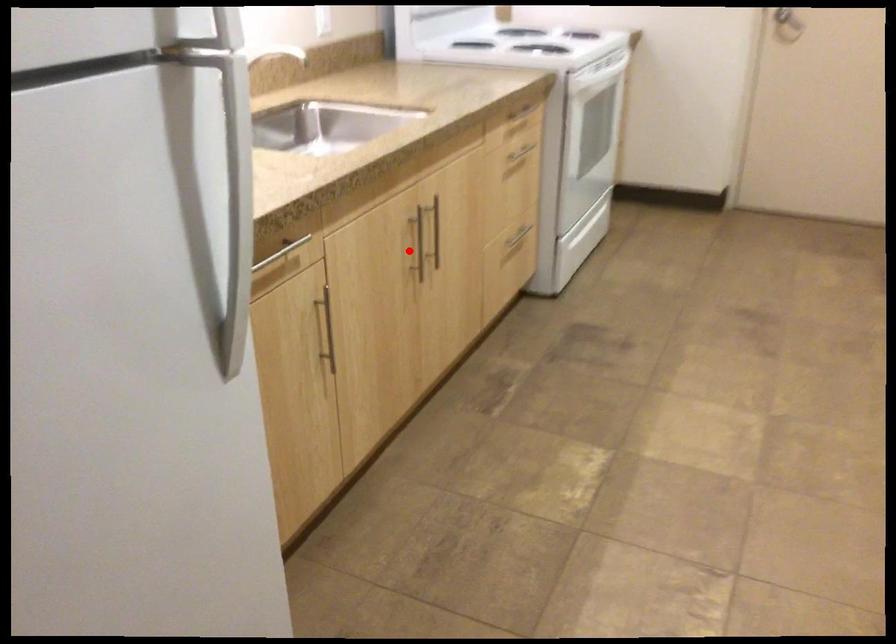
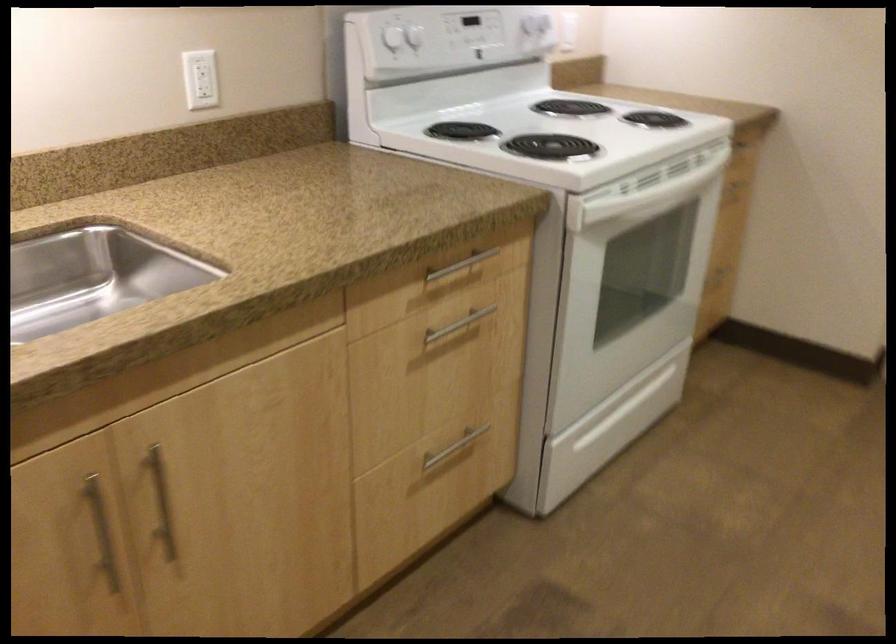
Question: I am providing you with two images of the same scene from different viewpoints. Image1 has a red point marked. In image2, the corresponding 3D location appears at what relative position? Reply with the corresponding letter.

Choices:
 (A) Closer
 (B) Farther

Answer: (A)